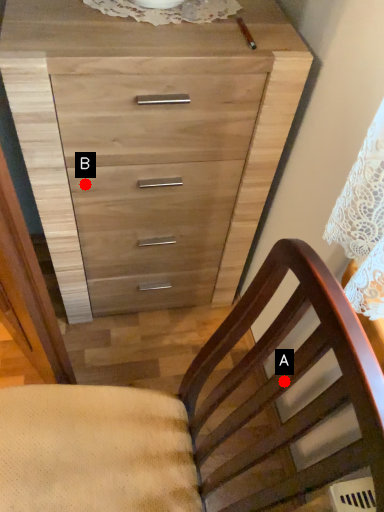
Question: Two points are circled on the image, labeled by A and B beside each circle. Among these points, which one is nearest to the camera?

Choices:
 (A) A is closer
 (B) B is closer

Answer: (A)